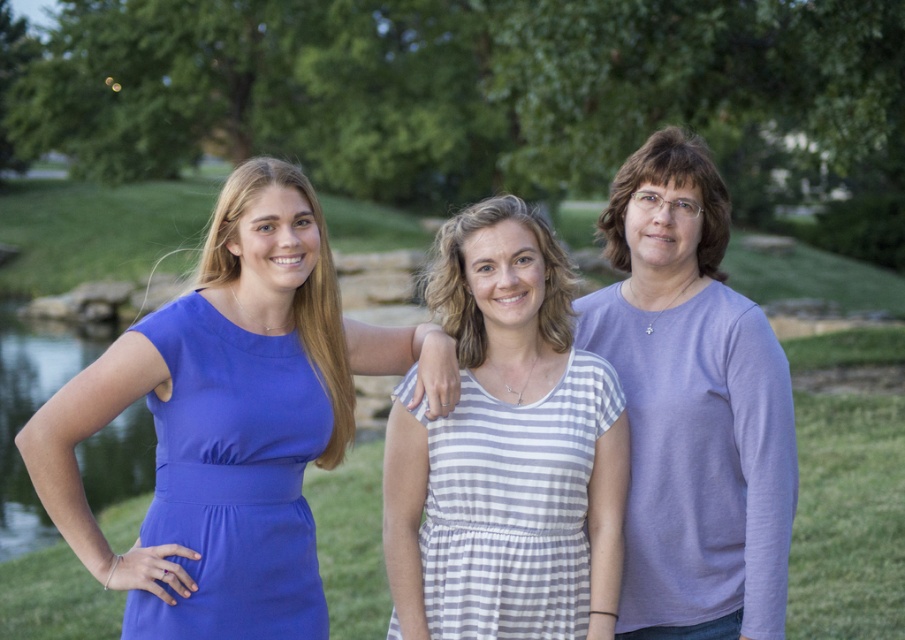
Question: Among these objects, which one is farthest from the camera?

Choices:
 (A) matte purple sweater at center
 (B) white striped fabric dress at center

Answer: (B)

Question: Is matte purple sweater at center wider than purple cotton shirt at center?

Choices:
 (A) yes
 (B) no

Answer: (A)

Question: Which of the following is the farthest from the observer?

Choices:
 (A) matte purple sweater at center
 (B) blue fabric dress at left

Answer: (B)

Question: Can you confirm if white striped fabric dress at center is positioned below blue fabric dress at left?

Choices:
 (A) yes
 (B) no

Answer: (A)

Question: Among these points, which one is farthest from the camera?

Choices:
 (A) (526, 483)
 (B) (222, 532)
 (C) (273, 563)

Answer: (A)

Question: Is matte purple sweater at center to the left of blue fabric dress at left from the viewer's perspective?

Choices:
 (A) yes
 (B) no

Answer: (B)